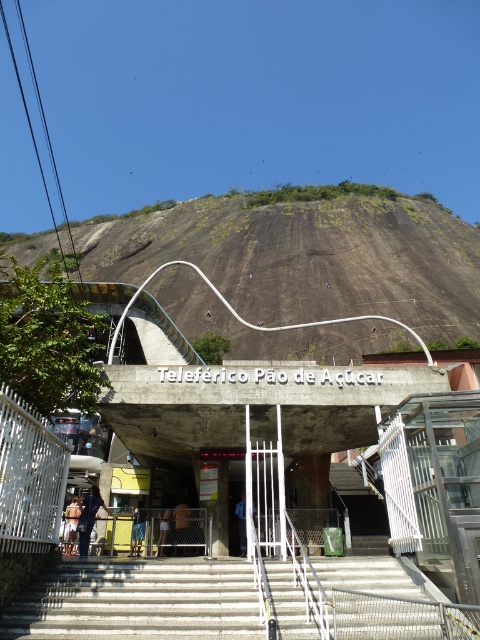
Does point (188, 512) come farther from viewer compared to point (160, 547)?

Yes, point (188, 512) is farther from viewer.

Find the location of a particular element. This screenshot has width=480, height=640. brown fabric shirt at center is located at coordinates (180, 525).

Who is more distant from viewer, (186, 512) or (165, 515)?

Point (165, 515)

Locate an element on the screen. The height and width of the screenshot is (640, 480). brown fabric shirt at center is located at coordinates (180, 525).

Who is more distant from viewer, (163,577) or (78,513)?

The point (78,513) is behind.

Does gray concrete stairs at center have a larger size compared to light brown leather jacket at lower left?

Indeed, gray concrete stairs at center has a larger size compared to light brown leather jacket at lower left.

You are a GUI agent. You are given a task and a screenshot of the screen. Output one action in this format:
    pyautogui.click(x=<x>, y=<y>)
    Task: Click on the gray concrete stairs at center
    
    Given the screenshot: What is the action you would take?
    coord(137,602)

The height and width of the screenshot is (640, 480). What are the coordinates of `gray concrete stairs at center` in the screenshot? It's located at point(137,602).

Is blue fabric shirt at center above dark blue fabric at center?

Yes, blue fabric shirt at center is above dark blue fabric at center.

From the picture: Is blue fabric shirt at center below dark blue fabric at center?

Actually, blue fabric shirt at center is above dark blue fabric at center.

Between point (132, 536) and point (240, 518), which one is positioned in front?

Point (132, 536)

This screenshot has height=640, width=480. Find the location of `blue fabric shirt at center`. blue fabric shirt at center is located at coordinates (137, 529).